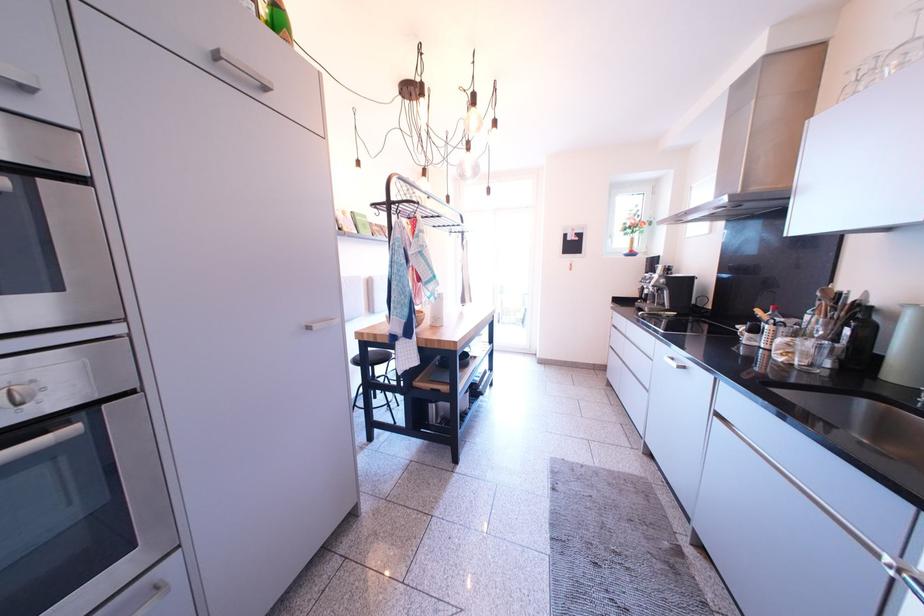
The width and height of the screenshot is (924, 616). What do you see at coordinates (277, 20) in the screenshot? I see `the green glass bottle` at bounding box center [277, 20].